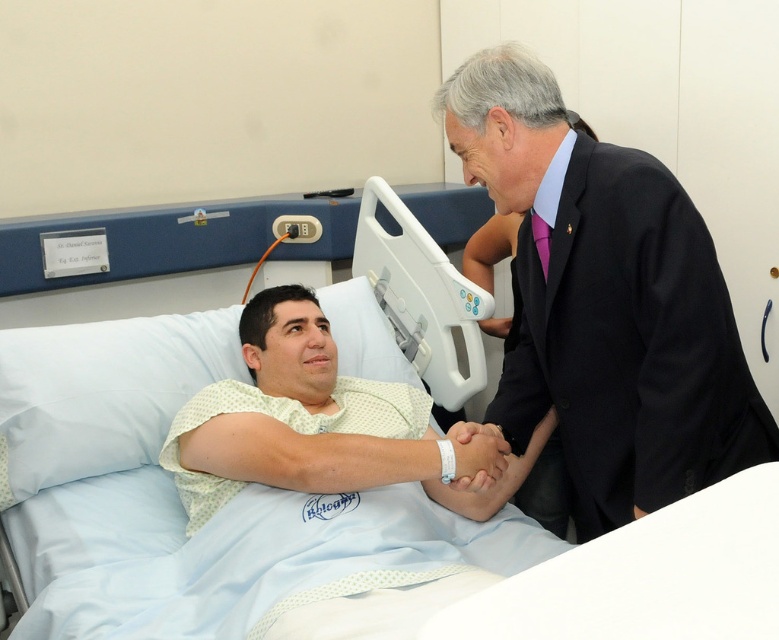
Question: Is light blue fabric hospital bed at center bigger than black satin business suit at right?

Choices:
 (A) no
 (B) yes

Answer: (B)

Question: Which of the following is the closest to the observer?

Choices:
 (A) light blue fabric hospital bed at center
 (B) black satin business suit at right

Answer: (B)

Question: Can you confirm if light blue fabric hospital bed at center is smaller than black satin business suit at right?

Choices:
 (A) yes
 (B) no

Answer: (B)

Question: Which point appears closest to the camera in this image?

Choices:
 (A) (654, 196)
 (B) (203, 362)

Answer: (A)

Question: Observing the image, what is the correct spatial positioning of light blue fabric hospital bed at center in reference to black satin business suit at right?

Choices:
 (A) below
 (B) above

Answer: (A)